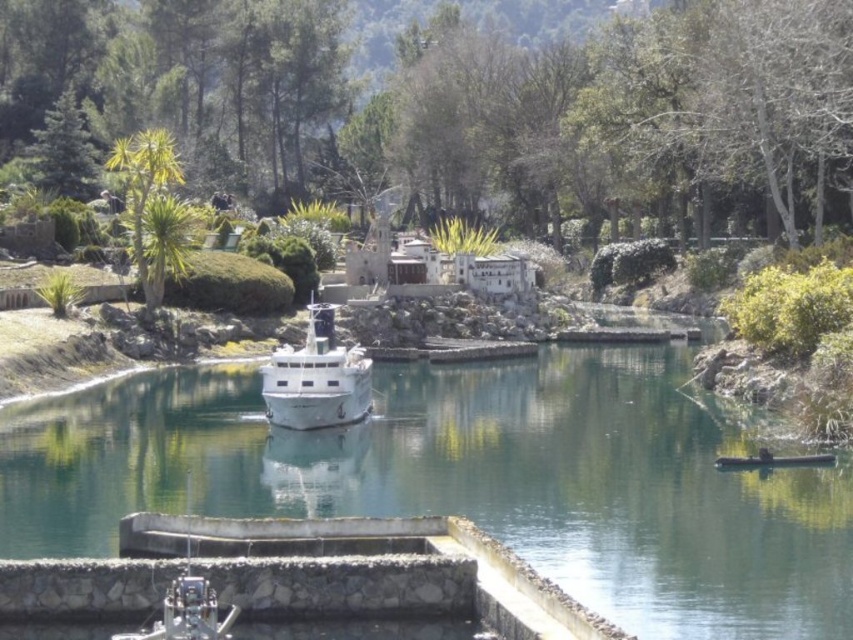
Consider the image. Can you confirm if green leafy tree at upper center is positioned above clear water at center?

Indeed, green leafy tree at upper center is positioned over clear water at center.

Is point (613, 186) farther from viewer compared to point (148, 452)?

Yes, it is.

The height and width of the screenshot is (640, 853). I want to click on green leafy tree at upper center, so click(x=457, y=109).

This screenshot has width=853, height=640. What do you see at coordinates (468, 481) in the screenshot?
I see `clear water at center` at bounding box center [468, 481].

How distant is clear water at center from green leafy tree at upper left?

clear water at center is 26.66 meters from green leafy tree at upper left.

Where is `clear water at center`? This screenshot has height=640, width=853. clear water at center is located at coordinates (x=468, y=481).

The image size is (853, 640). I want to click on clear water at center, so click(x=468, y=481).

Between green leafy tree at upper center and white glossy boat at center, which one has more height?

Standing taller between the two is green leafy tree at upper center.

Is green leafy tree at upper center smaller than white glossy boat at center?

Incorrect, green leafy tree at upper center is not smaller in size than white glossy boat at center.

Does point (260, 166) lie behind point (294, 385)?

Yes.

The height and width of the screenshot is (640, 853). I want to click on green leafy tree at upper center, so click(x=457, y=109).